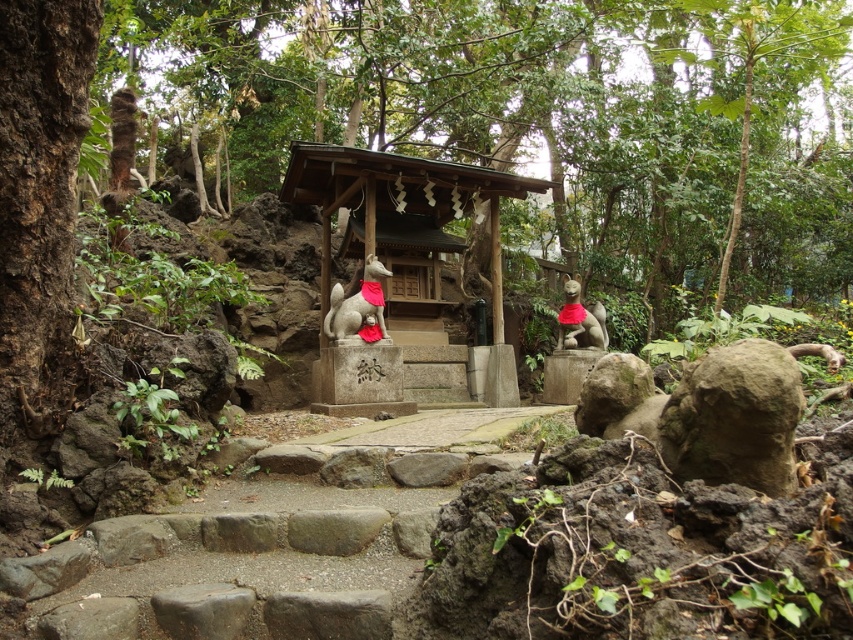
Question: Is smooth stone gazebo at center bigger than matte gray fox at center?

Choices:
 (A) no
 (B) yes

Answer: (B)

Question: Is smooth stone gazebo at center positioned behind matte stone fox at center?

Choices:
 (A) no
 (B) yes

Answer: (A)

Question: Is matte gray fox at center above matte stone fox at center?

Choices:
 (A) no
 (B) yes

Answer: (B)

Question: Which object is positioned closest to the matte gray fox at center?

Choices:
 (A) smooth stone gazebo at center
 (B) matte stone fox at center

Answer: (A)

Question: Which object is farther from the camera taking this photo?

Choices:
 (A) matte gray fox at center
 (B) smooth stone gazebo at center

Answer: (B)

Question: Among these points, which one is nearest to the camera?

Choices:
 (A) (595, 342)
 (B) (363, 304)
 (C) (368, 195)

Answer: (B)